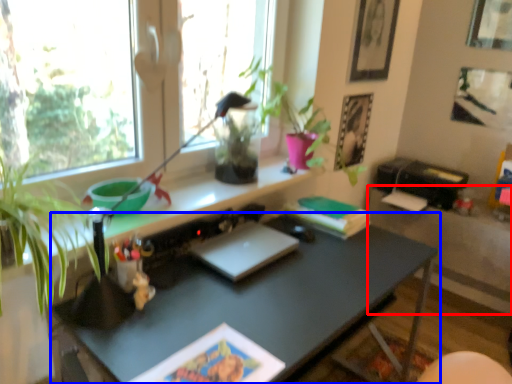
Question: Which object is further to the camera taking this photo, table (highlighted by a red box) or desk (highlighted by a blue box)?

Choices:
 (A) table
 (B) desk

Answer: (A)